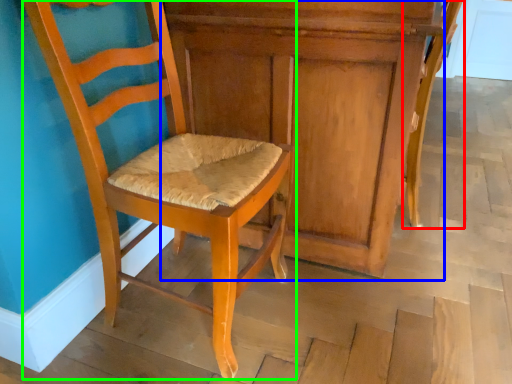
Question: Which object is positioned farthest from chair (highlighted by a red box)? Select from dresser (highlighted by a blue box) and chair (highlighted by a green box).

Choices:
 (A) dresser
 (B) chair

Answer: (B)